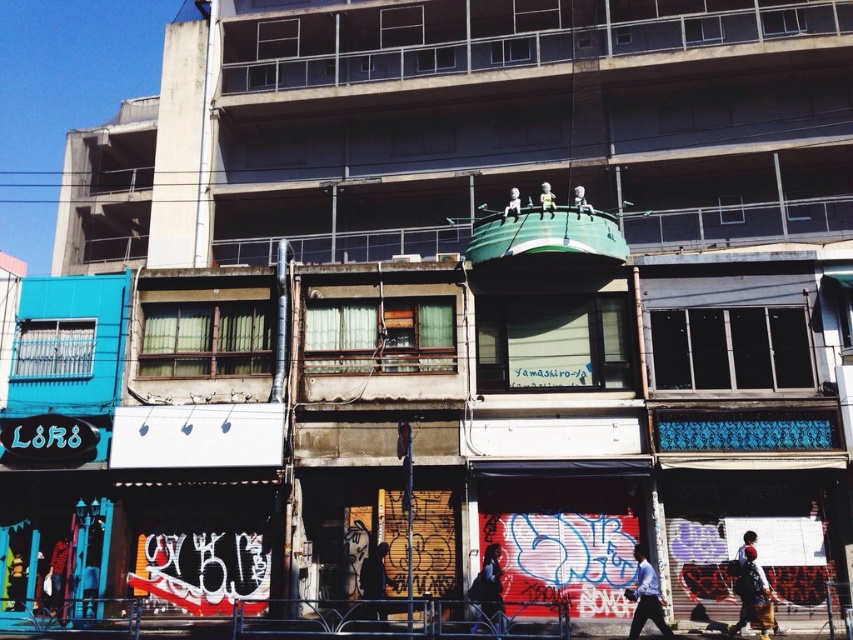
You are a pedestrian standing in front of the urban building. You see a light blue shirt at lower right and a metallic astronaut at upper center. Which object is closer to the ground?

The light blue shirt at lower right is closer to the ground because it is positioned below the metallic astronaut at upper center.

You are standing at the base of the building and notice two points marked on the facade. The first point is at coordinate point (735,557) and the second is at point (583,211). Which point is closer to you?

Point (735,557) is in front of point (583,211), so the first point is closer to you.

You are a window cleaner standing on the ground floor of the building. You see the white cotton shirt at lower right and the metallic astronaut at upper center. Which object is closer to you?

The white cotton shirt at lower right is closer to you because it is shorter than the metallic astronaut at upper center, meaning it is positioned lower on the building.